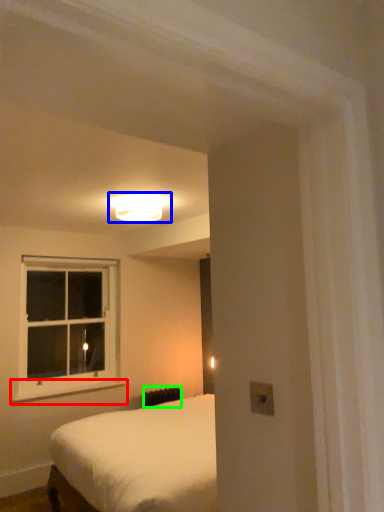
Question: Which object is the farthest from window sill (highlighted by a red box)? Choose among these: lamp (highlighted by a blue box) or radiator (highlighted by a green box).

Choices:
 (A) lamp
 (B) radiator

Answer: (A)